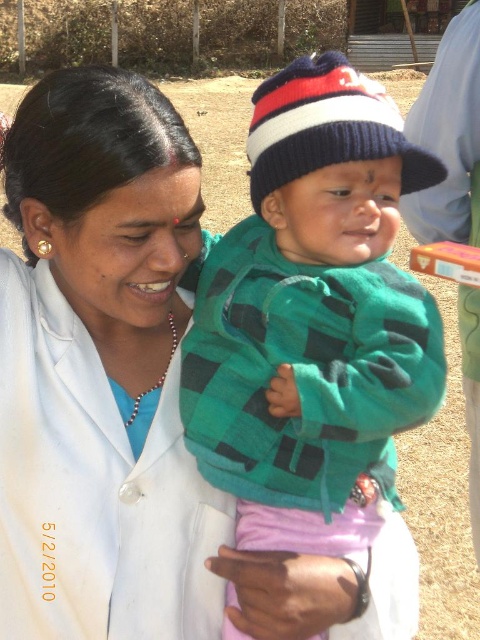
Question: Which point is farther from the camera taking this photo?

Choices:
 (A) (388, 145)
 (B) (134, 609)

Answer: (B)

Question: From the image, what is the correct spatial relationship of white smooth lab coat at center in relation to green plaid sweater at center?

Choices:
 (A) above
 (B) below

Answer: (B)

Question: Is white smooth lab coat at center closer to the viewer compared to green plaid sweater at center?

Choices:
 (A) no
 (B) yes

Answer: (B)

Question: In this image, where is white smooth lab coat at center located relative to green plaid sweater at center?

Choices:
 (A) left
 (B) right

Answer: (A)